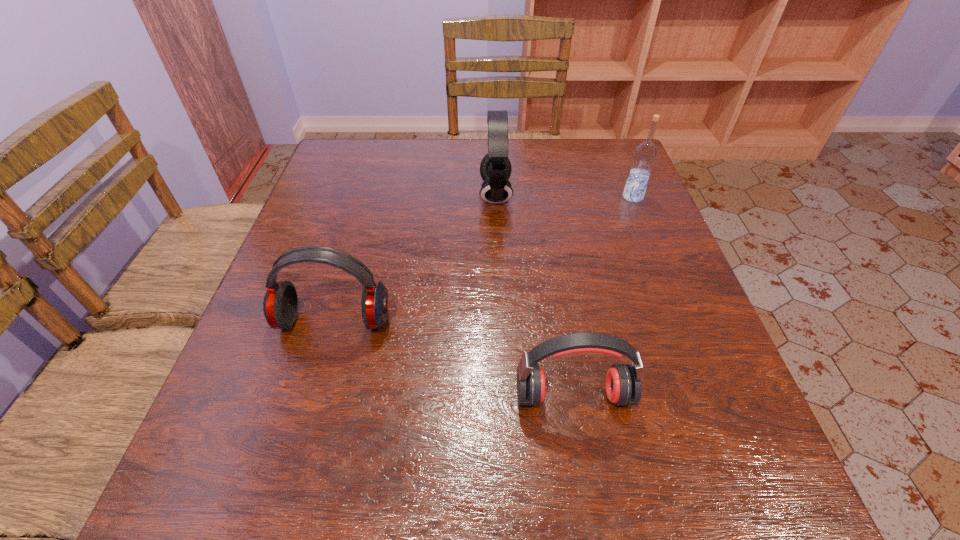
In the image, there is a desktop. Identify the location of free space at the far right corner. The height and width of the screenshot is (540, 960). (605, 159).

The image size is (960, 540). What are the coordinates of `empty space that is in between the nearest earphone and the second nearest earphone` in the screenshot? It's located at (454, 358).

This screenshot has width=960, height=540. What are the coordinates of `empty location between the farthest earphone and the nearest earphone` in the screenshot? It's located at (535, 295).

Locate an element on the screen. free space that is in between the nearest object and the vodka is located at coordinates (603, 296).

Image resolution: width=960 pixels, height=540 pixels. I want to click on free spot between the leftmost object and the vodka, so click(484, 259).

This screenshot has width=960, height=540. Find the location of `empty location between the tallest earphone and the leftmost object`. empty location between the tallest earphone and the leftmost object is located at coordinates (415, 258).

Image resolution: width=960 pixels, height=540 pixels. I want to click on free space between the leftmost object and the farthest earphone, so click(415, 258).

You are a GUI agent. You are given a task and a screenshot of the screen. Output one action in this format:
    pyautogui.click(x=<x>, y=<y>)
    Task: Click on the free space between the third farthest object and the nearest object
    This screenshot has width=960, height=540.
    Given the screenshot: What is the action you would take?
    pyautogui.click(x=454, y=358)

Image resolution: width=960 pixels, height=540 pixels. In order to click on free area in between the rightmost object and the leftmost earphone in this screenshot , I will do `click(484, 259)`.

Where is `free area in between the rightmost object and the farthest earphone`? The height and width of the screenshot is (540, 960). free area in between the rightmost object and the farthest earphone is located at coordinates (564, 195).